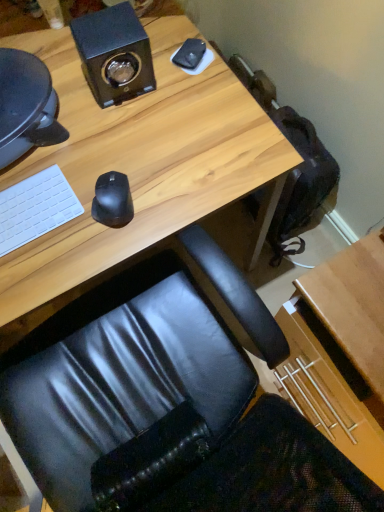
Locate an element on the screen. Image resolution: width=384 pixels, height=512 pixels. unoccupied region to the right of black matte mouse at center is located at coordinates (179, 186).